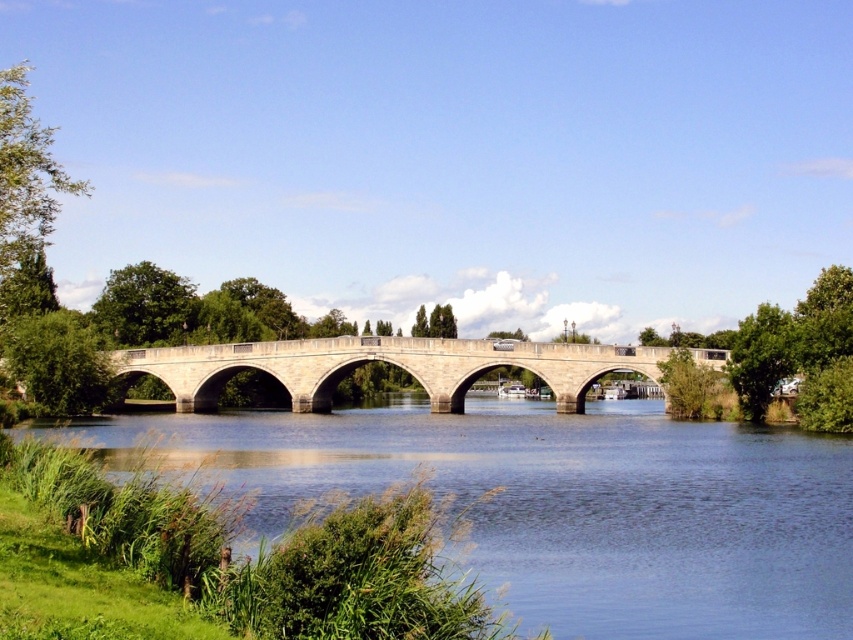
Question: Which of the following is the closest to the observer?

Choices:
 (A) (671, 426)
 (B) (323, 365)

Answer: (A)

Question: Can you confirm if blue stone bridge at center is thinner than stone bridge at center?

Choices:
 (A) no
 (B) yes

Answer: (A)

Question: Which point is closer to the camera?

Choices:
 (A) blue stone bridge at center
 (B) stone bridge at center

Answer: (A)

Question: Can you confirm if blue stone bridge at center is positioned to the left of stone bridge at center?

Choices:
 (A) no
 (B) yes

Answer: (A)

Question: Considering the relative positions of blue stone bridge at center and stone bridge at center in the image provided, where is blue stone bridge at center located with respect to stone bridge at center?

Choices:
 (A) below
 (B) above

Answer: (A)